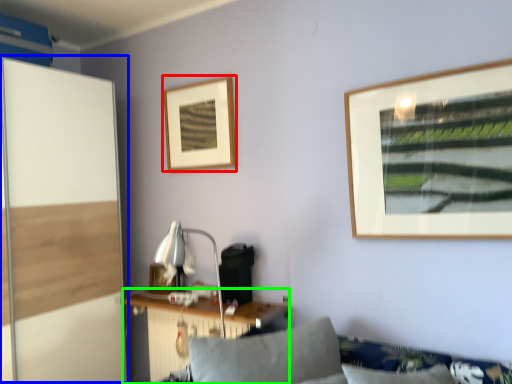
Question: Based on their relative distances, which object is nearer to picture frame (highlighted by a red box)? Choose from screen door (highlighted by a blue box) and table (highlighted by a green box).

Choices:
 (A) screen door
 (B) table

Answer: (A)